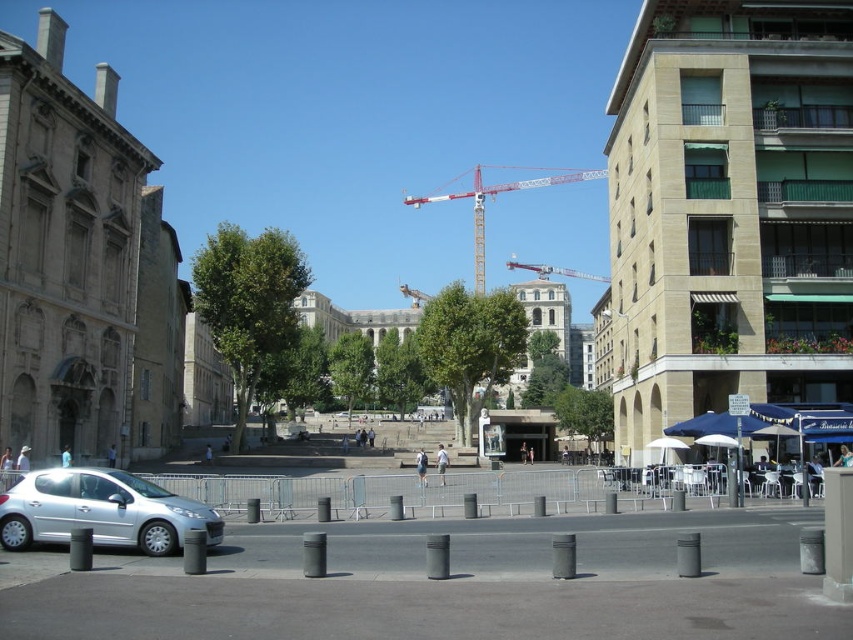
Question: Can you confirm if silver metallic car at lower left is positioned to the right of metallic construction crane at center?

Choices:
 (A) no
 (B) yes

Answer: (A)

Question: Does silver metallic car at lower left have a lesser width compared to metallic red crane at center?

Choices:
 (A) no
 (B) yes

Answer: (B)

Question: In this image, where is white metal crane at center located relative to metallic construction crane at center?

Choices:
 (A) right
 (B) left

Answer: (A)

Question: Which of the following is the closest to the observer?

Choices:
 (A) white metal crane at center
 (B) metallic construction crane at center
 (C) metallic red crane at center

Answer: (A)

Question: Which of these objects is positioned farthest from the silver metallic car at lower left?

Choices:
 (A) white metal crane at center
 (B) metallic construction crane at center
 (C) metallic red crane at center

Answer: (B)

Question: Based on their relative distances, which object is nearer to the metallic construction crane at center?

Choices:
 (A) silver metallic car at lower left
 (B) metallic red crane at center

Answer: (B)